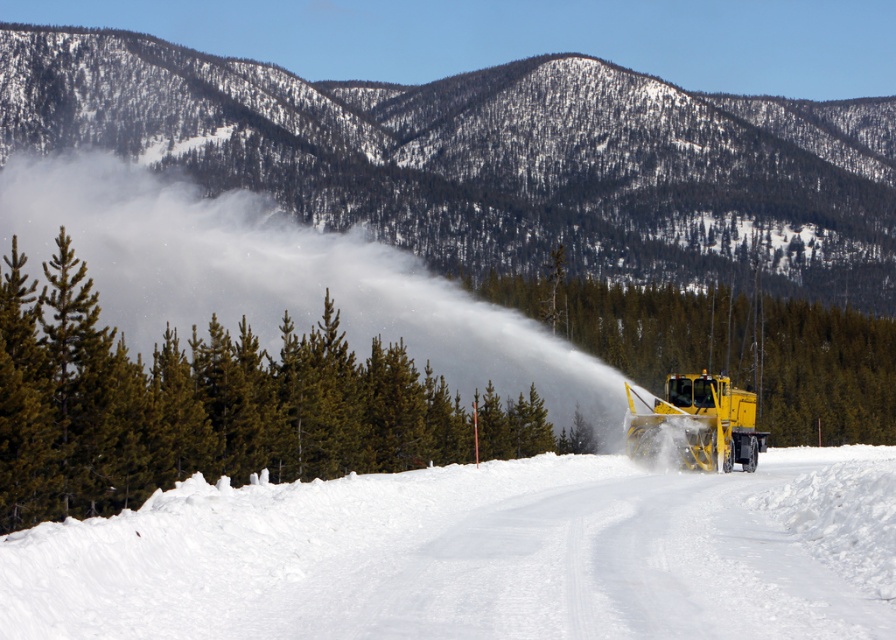
Is point (175, 506) in front of point (770, 310)?

Yes.

Can you confirm if white powdery snow at center is taller than green matte tree at center?

No.

Is point (170, 529) positioned before point (773, 396)?

Yes, it is in front of point (773, 396).

Locate an element on the screen. white powdery snow at center is located at coordinates (480, 554).

Which is behind, point (676, 349) or point (682, 444)?

The point (676, 349) is more distant.

Which is in front, point (867, 440) or point (737, 428)?

Point (737, 428) is more forward.

You are a GUI agent. You are given a task and a screenshot of the screen. Output one action in this format:
    pyautogui.click(x=<x>, y=<y>)
    Task: Click on the green matte tree at center
    The image size is (896, 640).
    Given the screenshot: What is the action you would take?
    pyautogui.click(x=728, y=348)

Who is more distant from viewer, (550, 211) or (764, 616)?

The point (550, 211) is behind.

Is snowy forested mountain at upper center wider than white powdery snow at center?

Correct, the width of snowy forested mountain at upper center exceeds that of white powdery snow at center.

Is point (761, 177) positioned in front of point (596, 560)?

No, (761, 177) is further to viewer.

Locate an element on the screen. This screenshot has width=896, height=640. snowy forested mountain at upper center is located at coordinates (494, 160).